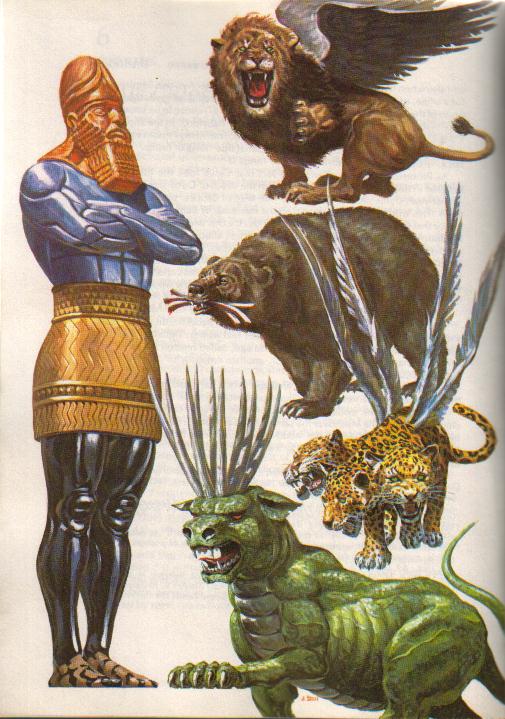
The image size is (505, 719). In order to click on art in this screenshot , I will do `click(473, 78)`.